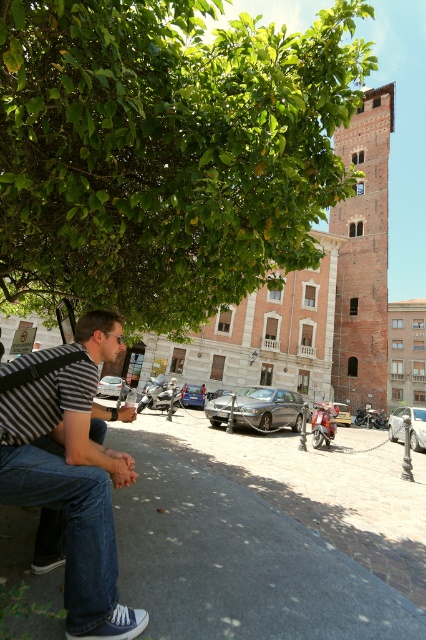
Is striped fabric shirt at left bigger than brick tower at center?

Incorrect, striped fabric shirt at left is not larger than brick tower at center.

Does striped fabric shirt at left appear under brick tower at center?

Indeed, striped fabric shirt at left is positioned under brick tower at center.

Is point (14, 420) more distant than point (379, 321)?

No, it is in front of (379, 321).

Locate an element on the screen. striped fabric shirt at left is located at coordinates (71, 476).

Does green leafy tree at upper left come behind striped fabric shirt at left?

No, green leafy tree at upper left is closer to the viewer.

Can you confirm if green leafy tree at upper left is shorter than striped fabric shirt at left?

No.

Where is `green leafy tree at upper left`? This screenshot has width=426, height=640. green leafy tree at upper left is located at coordinates (166, 152).

Where is `green leafy tree at upper left`? green leafy tree at upper left is located at coordinates (166, 152).

Between green leafy tree at upper left and brick tower at center, which one appears on the right side from the viewer's perspective?

Positioned to the right is brick tower at center.

Is green leafy tree at upper left closer to camera compared to brick tower at center?

Yes, it is.

Who is more forward, (x=268, y=195) or (x=345, y=321)?

Point (x=268, y=195) is more forward.

I want to click on green leafy tree at upper left, so click(x=166, y=152).